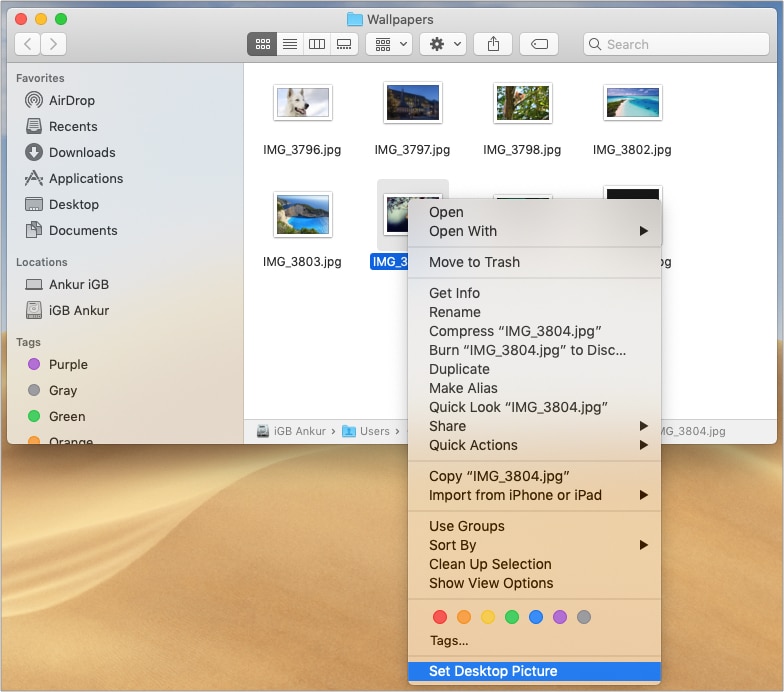
You are a GUI agent. You are given a task and a screenshot of the screen. Output one action in this format:
    pyautogui.click(x=<x>, y=<y>)
    Task: Click on the files
    The height and width of the screenshot is (692, 784).
    Given the screenshot: What is the action you would take?
    pyautogui.click(x=307, y=108), pyautogui.click(x=412, y=93), pyautogui.click(x=543, y=93), pyautogui.click(x=612, y=102), pyautogui.click(x=633, y=192), pyautogui.click(x=404, y=198), pyautogui.click(x=291, y=212)